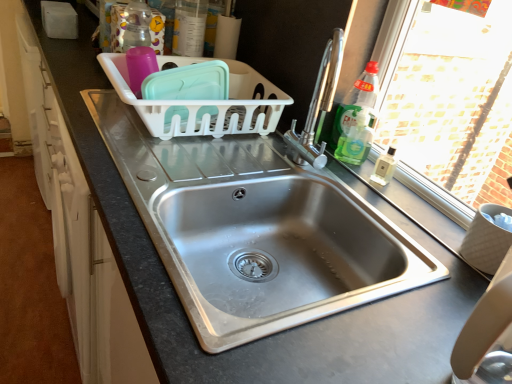
Question: Looking at their shapes, would you say white plastic basket at center is wider or thinner than green glass bottle at upper right, which ranks as the 2th bottle in bottom-to-top order?

Choices:
 (A) thin
 (B) wide

Answer: (B)

Question: Is point (185, 109) closer or farther from the camera than point (336, 122)?

Choices:
 (A) farther
 (B) closer

Answer: (B)

Question: Estimate the real-world distances between objects in this image. Which object is closer to the stainless steel sink at center, the first sink from the top?

Choices:
 (A) green glass bottle at upper right, the 2th bottle when ordered from left to right
 (B) translucent plastic container at upper center, the 3th bottle when ordered from bottom to top
 (C) stainless steel sink at center, the first sink in the bottom-to-top sequence
 (D) green translucent soap dispenser at right, the 1th bottle positioned from the right
 (E) white plastic basket at center

Answer: (C)

Question: Which of these objects is positioned farthest from the translucent plastic container at upper center, the 1th bottle in the top-to-bottom sequence?

Choices:
 (A) white plastic basket at center
 (B) stainless steel sink at center, the first sink from the top
 (C) green translucent soap dispenser at right, acting as the first bottle starting from the bottom
 (D) green glass bottle at upper right, which ranks as the 2th bottle in bottom-to-top order
 (E) stainless steel sink at center, the first sink in the bottom-to-top sequence

Answer: (B)